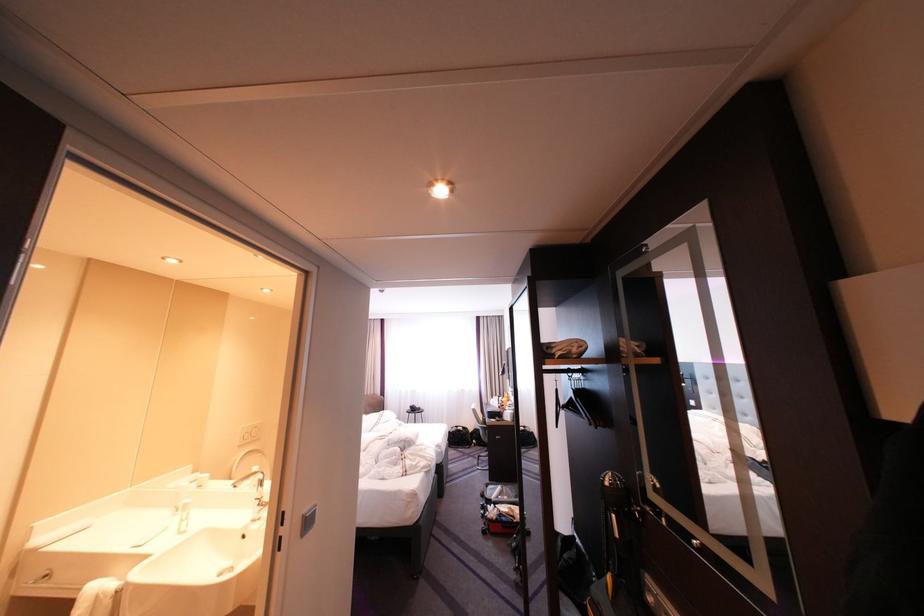
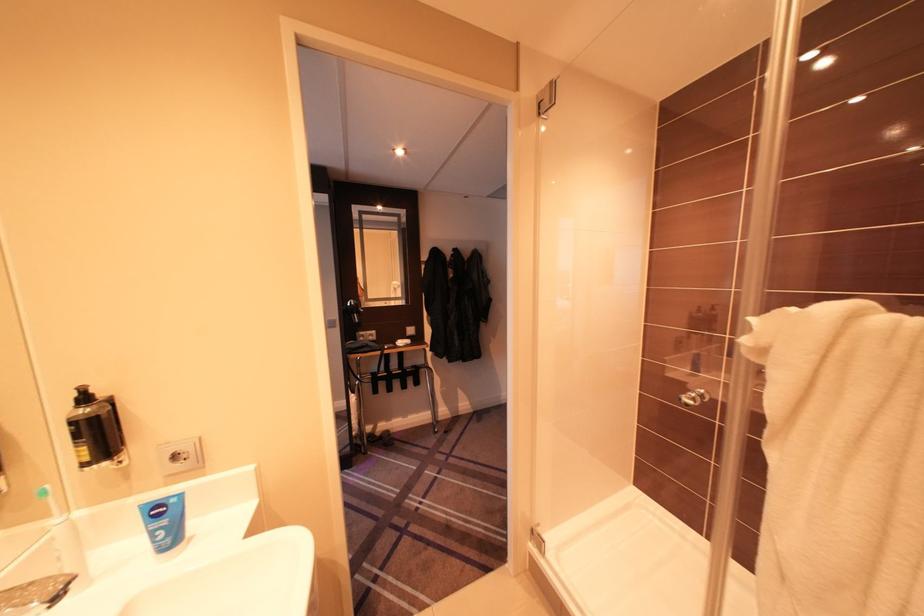
Locate, in the second image, the point that corresponds to point (662, 583) in the first image.

(372, 334)